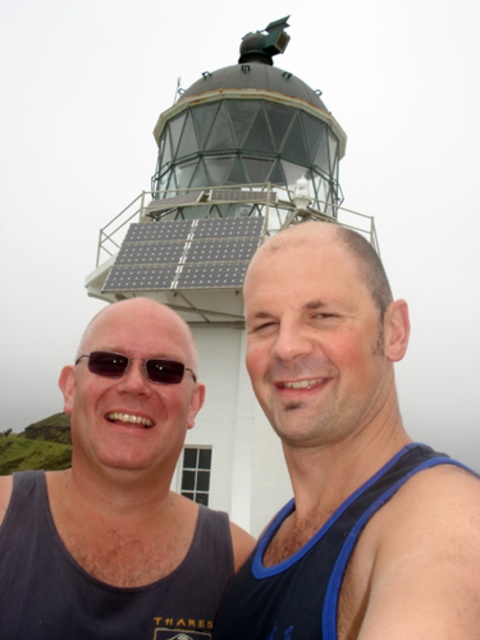
Which is more to the left, black fabric tank top at center or black matte sunglasses at left?

Positioned to the left is black matte sunglasses at left.

From the picture: Does black fabric tank top at center appear on the left side of black matte sunglasses at left?

No, black fabric tank top at center is not to the left of black matte sunglasses at left.

Which is behind, point (349, 296) or point (175, 384)?

The point (175, 384) is more distant.

Locate an element on the screen. black fabric tank top at center is located at coordinates (347, 461).

Does black fabric tank top at center appear on the left side of dark gray tank top at left?

Incorrect, black fabric tank top at center is not on the left side of dark gray tank top at left.

Who is positioned more to the right, black fabric tank top at center or dark gray tank top at left?

Positioned to the right is black fabric tank top at center.

Locate an element on the screen. black fabric tank top at center is located at coordinates (347, 461).

The width and height of the screenshot is (480, 640). Identify the location of black fabric tank top at center. (347, 461).

Can you confirm if black fabric tank top at center is positioned above metallic lighthouse at upper center?

No.

Identify the location of black fabric tank top at center. (347, 461).